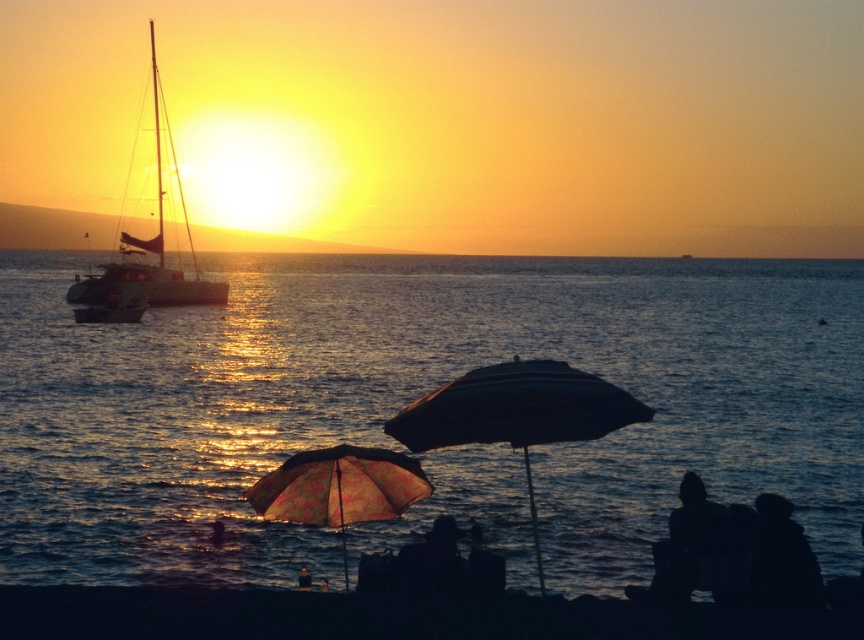
Between blue water at center and black sand at lower center, which one appears on the right side from the viewer's perspective?

Positioned to the right is blue water at center.

Who is taller, blue water at center or black sand at lower center?

Standing taller between the two is blue water at center.

Which is in front, point (701, 323) or point (556, 609)?

Point (556, 609) is more forward.

Where is `blue water at center`? This screenshot has width=864, height=640. blue water at center is located at coordinates (414, 397).

Does dark striped umbrella at center appear under white matte sailboat at left?

Correct, dark striped umbrella at center is located below white matte sailboat at left.

This screenshot has height=640, width=864. Describe the element at coordinates (518, 413) in the screenshot. I see `dark striped umbrella at center` at that location.

Locate an element on the screen. dark striped umbrella at center is located at coordinates [518, 413].

Locate an element on the screen. This screenshot has height=640, width=864. dark striped umbrella at center is located at coordinates (518, 413).

Is blue water at center smaller than dark striped umbrella at center?

Actually, blue water at center might be larger than dark striped umbrella at center.

At what (x,y) coordinates should I click in order to perform the action: click on blue water at center. Please return your answer as a coordinate pair (x, y). This screenshot has height=640, width=864. Looking at the image, I should click on (414, 397).

Who is more distant from viewer, (217, 435) or (475, 376)?

Positioned behind is point (217, 435).

The image size is (864, 640). I want to click on blue water at center, so [414, 397].